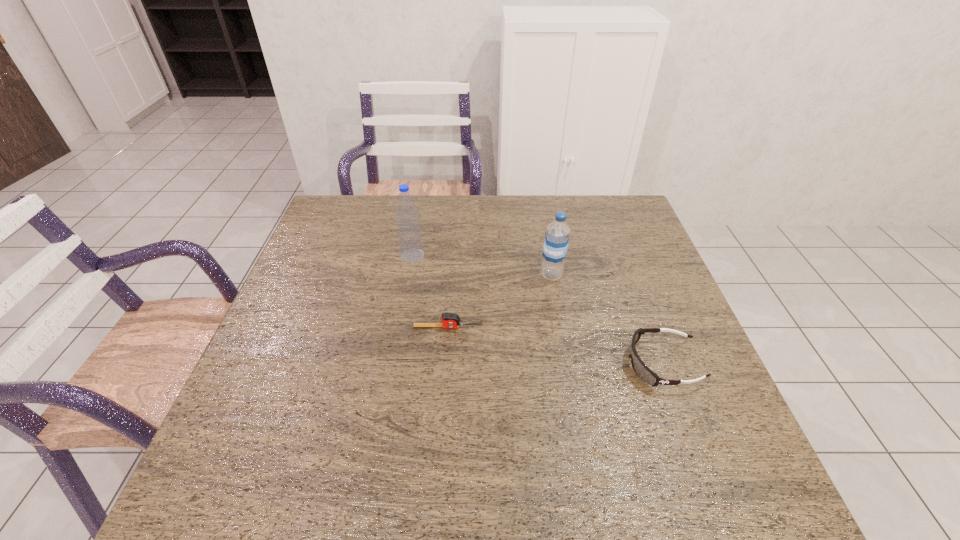
Image resolution: width=960 pixels, height=540 pixels. I want to click on the left water bottle, so (409, 232).

At what (x,y) coordinates should I click in order to perform the action: click on the farthest object. Please return your answer as a coordinate pair (x, y). Looking at the image, I should click on (409, 232).

This screenshot has height=540, width=960. What are the coordinates of `the nearer water bottle` in the screenshot? It's located at (557, 234).

You are a GUI agent. You are given a task and a screenshot of the screen. Output one action in this format:
    pyautogui.click(x=<x>, y=<y>)
    Task: Click on the third nearest object
    
    Given the screenshot: What is the action you would take?
    pyautogui.click(x=557, y=234)

Find the location of `goggles`. goggles is located at coordinates (643, 372).

Locate an element on the screen. The height and width of the screenshot is (540, 960). the second shortest object is located at coordinates (643, 372).

This screenshot has width=960, height=540. Identify the location of tape measure. pos(449,320).

Locate an element on the screen. The image size is (960, 540). the second object from left to right is located at coordinates (449, 320).

In order to click on free space located on the right of the leftmost object in this screenshot , I will do `click(485, 256)`.

Locate an element on the screen. vacant point located on the label of the second object from right to left is located at coordinates (437, 275).